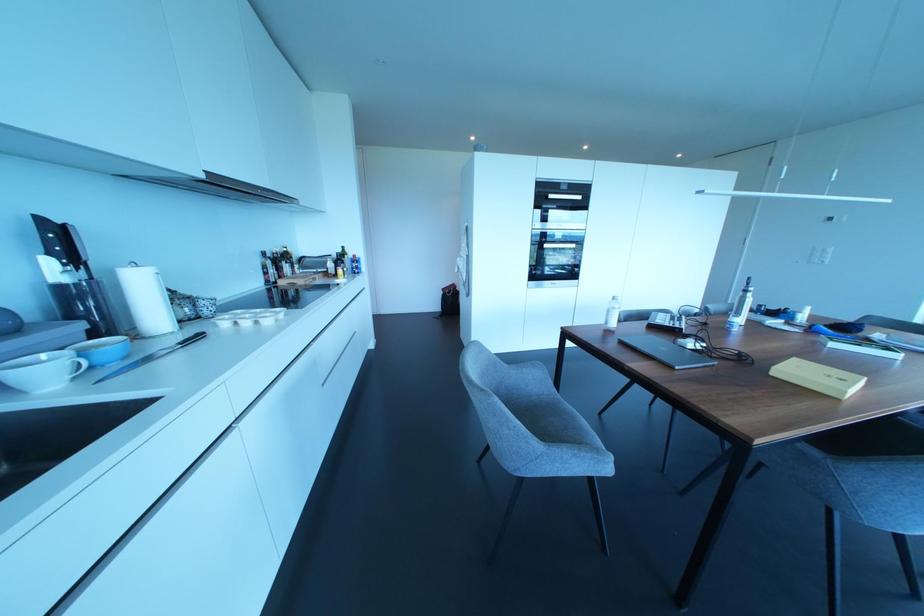
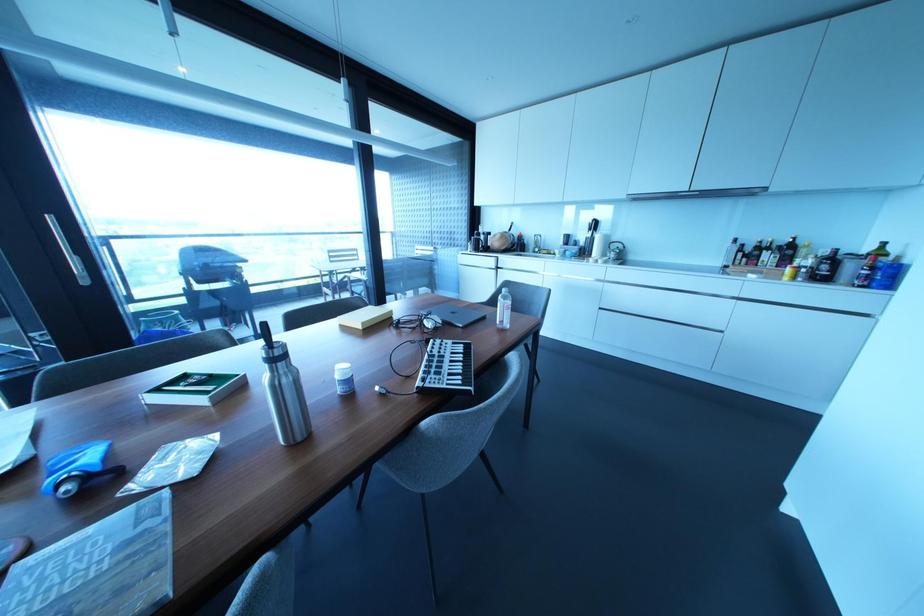
The point at (x=337, y=259) is marked in the first image. Where is the corresponding point in the second image?

(833, 257)